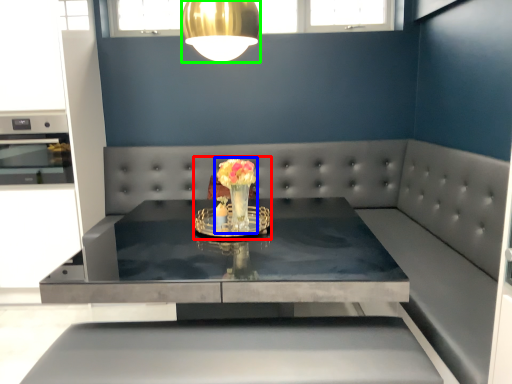
Question: Which is nearer to the floral arrangement (highlighted by a red box)? floral arrangement (highlighted by a blue box) or lamp (highlighted by a green box).

Choices:
 (A) floral arrangement
 (B) lamp

Answer: (A)